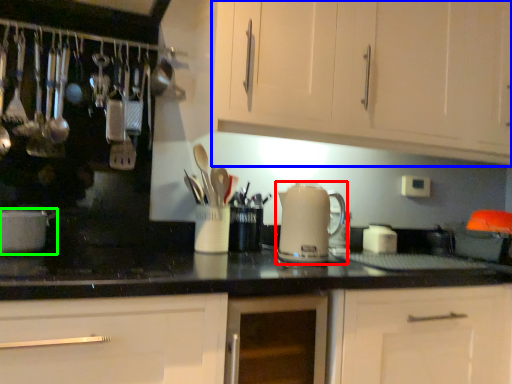
Question: Based on their relative distances, which object is nearer to kitchen appliance (highlighted by a red box)? Choose from cabinetry (highlighted by a blue box) and home appliance (highlighted by a green box).

Choices:
 (A) cabinetry
 (B) home appliance

Answer: (A)